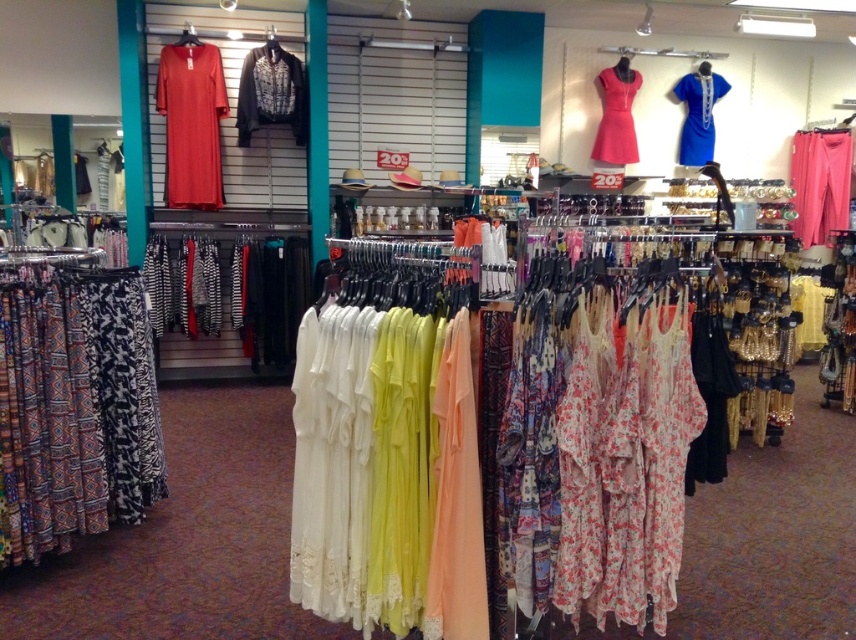
Question: Considering the real-world distances, which object is farthest from the black sequined blouse at upper center?

Choices:
 (A) matte pink dress at upper center
 (B) pink fabric pants at right
 (C) blue satin dress at upper right
 (D) printed cotton skirt at left

Answer: (B)

Question: From the image, what is the correct spatial relationship of pink fabric pants at right in relation to matte pink dress at upper center?

Choices:
 (A) above
 (B) below

Answer: (B)

Question: Which object appears closest to the camera in this image?

Choices:
 (A) printed cotton skirt at left
 (B) blue satin dress at upper right

Answer: (A)

Question: Which point is farther from the camera taking this photo?

Choices:
 (A) (724, 86)
 (B) (294, 118)
 (C) (57, 516)
 (D) (801, 198)

Answer: (D)

Question: Can you confirm if pink fabric pants at right is wider than black sequined blouse at upper center?

Choices:
 (A) no
 (B) yes

Answer: (B)

Question: Is pink fabric pants at right below blue satin dress at upper right?

Choices:
 (A) no
 (B) yes

Answer: (B)